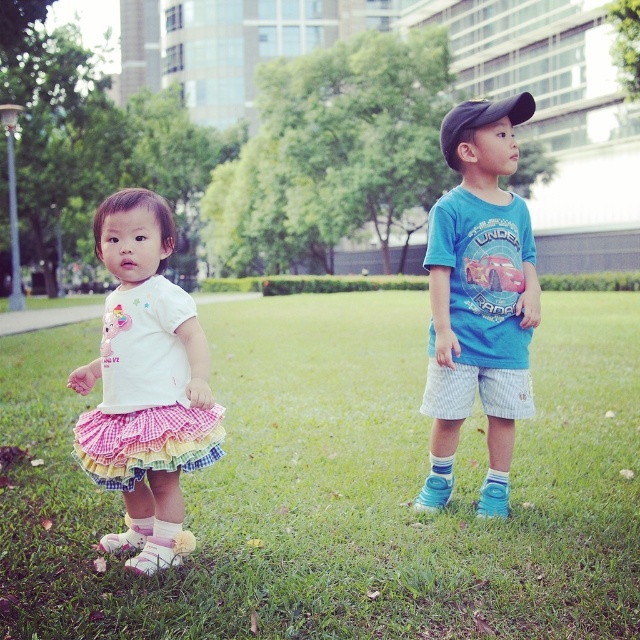
Question: Which of the following is the farthest from the observer?

Choices:
 (A) blue cotton shirt at right
 (B) black fabric baseball cap at upper right
 (C) green grass at center

Answer: (B)

Question: Is green grass at center below pastel gingham ballet skirt at lower left?

Choices:
 (A) no
 (B) yes

Answer: (A)

Question: Which is nearer to the blue cotton shirt at right?

Choices:
 (A) black fabric baseball cap at upper right
 (B) pastel gingham ballet skirt at lower left
 (C) white cotton shirt at center

Answer: (A)

Question: Which of the following is the farthest from the observer?

Choices:
 (A) (92, 458)
 (B) (416, 342)
 (C) (515, 336)
 (D) (140, 464)

Answer: (B)

Question: Can you confirm if white cotton shirt at center is positioned below pastel gingham ballet skirt at lower left?

Choices:
 (A) yes
 (B) no

Answer: (B)

Question: From the image, what is the correct spatial relationship of blue cotton shirt at right in relation to white cotton shirt at center?

Choices:
 (A) above
 (B) below

Answer: (A)